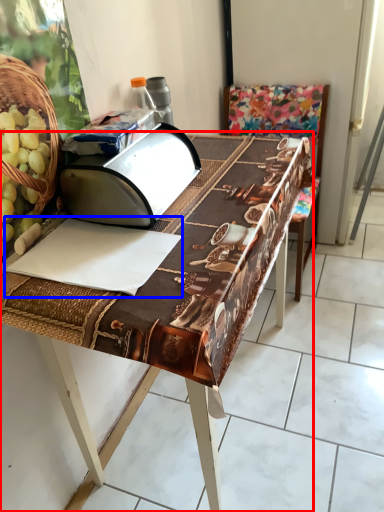
Question: Which point is closer to the camera, table (highlighted by a red box) or wrapping paper (highlighted by a blue box)?

Choices:
 (A) table
 (B) wrapping paper

Answer: (A)